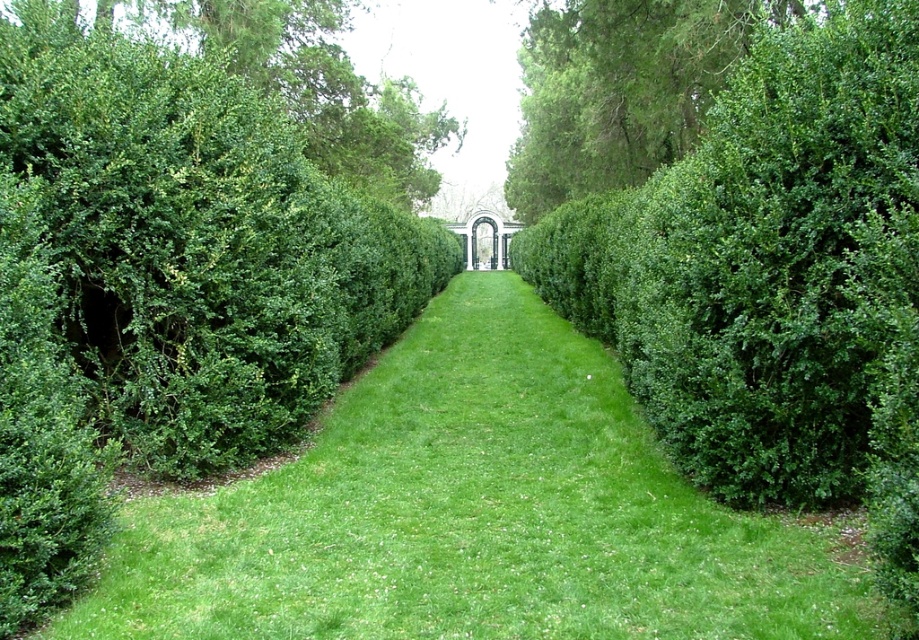
Question: Which of the following is the closest to the observer?

Choices:
 (A) (643, 177)
 (B) (328, 170)

Answer: (A)

Question: Among these objects, which one is farthest from the camera?

Choices:
 (A) green leafy bush at upper left
 (B) green leafy bush at upper right
 (C) green grass at center

Answer: (B)

Question: Can you confirm if green grass at center is thinner than green leafy bush at upper left?

Choices:
 (A) no
 (B) yes

Answer: (B)

Question: Is green grass at center wider than green leafy bush at upper right?

Choices:
 (A) yes
 (B) no

Answer: (A)

Question: Which object is positioned farthest from the green leafy bush at upper right?

Choices:
 (A) green grass at center
 (B) green leafy bush at upper left

Answer: (A)

Question: Can you confirm if green grass at center is wider than green leafy bush at upper right?

Choices:
 (A) yes
 (B) no

Answer: (A)